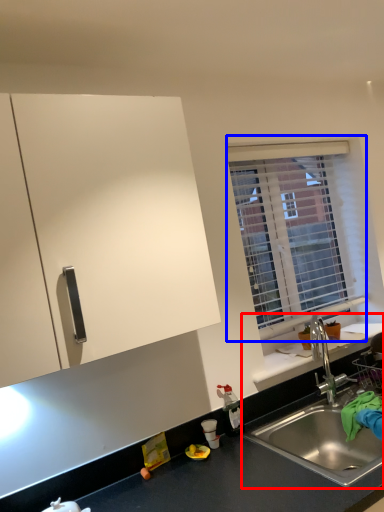
Question: Which of the following is the farthest to the observer, sink (highlighted by a red box) or window (highlighted by a blue box)?

Choices:
 (A) sink
 (B) window

Answer: (B)